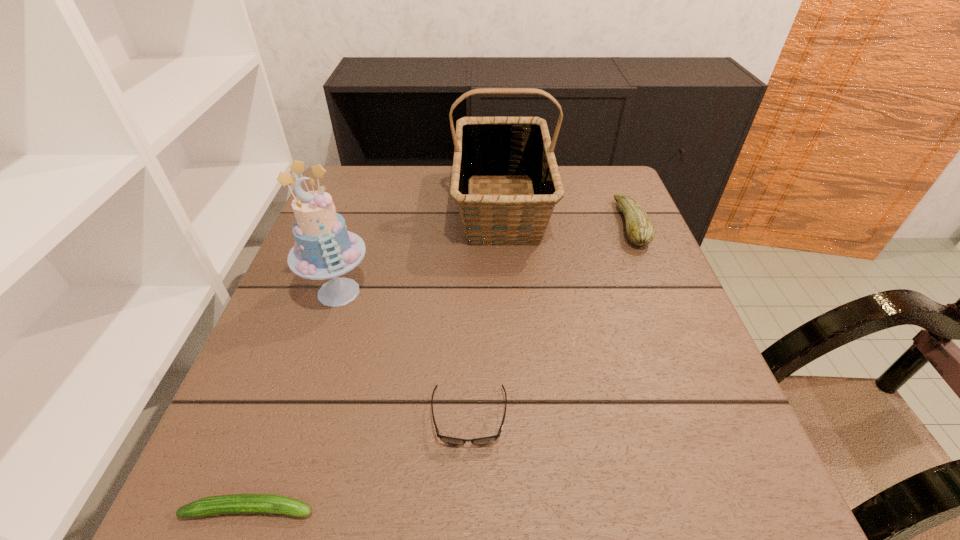
Locate an element on the screen. The height and width of the screenshot is (540, 960). the second closest object to the basket is located at coordinates (324, 248).

Locate an element on the screen. Image resolution: width=960 pixels, height=540 pixels. vacant area that satisfies the following two spatial constraints: 1. on the front-facing side of the fourth farthest object; 2. on the front-facing side of the nearer zucchini is located at coordinates (468, 509).

Where is `vacant space that satisfies the following two spatial constraints: 1. at the stem end of the right zucchini; 2. on the front-facing side of the fourth farthest object`? Image resolution: width=960 pixels, height=540 pixels. vacant space that satisfies the following two spatial constraints: 1. at the stem end of the right zucchini; 2. on the front-facing side of the fourth farthest object is located at coordinates (711, 417).

Where is `vacant space that satisfies the following two spatial constraints: 1. at the stem end of the rightmost object; 2. on the front-facing side of the sunglasses`? The width and height of the screenshot is (960, 540). vacant space that satisfies the following two spatial constraints: 1. at the stem end of the rightmost object; 2. on the front-facing side of the sunglasses is located at coordinates (711, 417).

The height and width of the screenshot is (540, 960). What are the coordinates of `vacant space that satisfies the following two spatial constraints: 1. at the stem end of the farther zucchini; 2. on the front-facing side of the fourth farthest object` in the screenshot? It's located at (711, 417).

Image resolution: width=960 pixels, height=540 pixels. Identify the location of free point that satisfies the following two spatial constraints: 1. by the handle of the basket; 2. on the front-facing side of the shortest object. (522, 509).

In order to click on free location that satisfies the following two spatial constraints: 1. on the front-facing side of the second nearest object; 2. on the front-facing side of the left zucchini in this screenshot , I will do `click(468, 509)`.